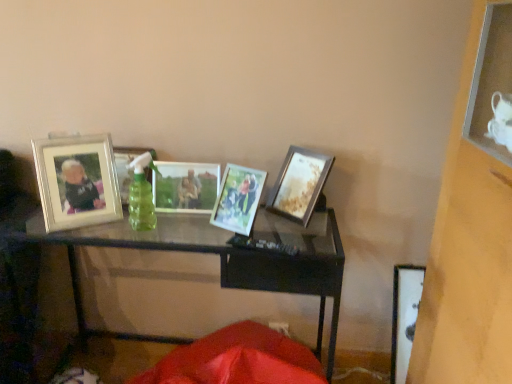
Question: From a real-world perspective, relative to silver metallic photo frame at left, arranged as the first picture frame when viewed from the left, is black glass table at center vertically above or below?

Choices:
 (A) below
 (B) above

Answer: (A)

Question: Based on their sizes in the image, would you say black glass table at center is bigger or smaller than silver metallic photo frame at left, arranged as the fifth picture frame when viewed from the right?

Choices:
 (A) small
 (B) big

Answer: (B)

Question: Based on their relative distances, which object is farther from the matte glass picture frame at left, the fourth picture frame from the right?

Choices:
 (A) silver metallic photo frame at left, arranged as the fifth picture frame when viewed from the right
 (B) metallic silver photo frame at center, the second picture frame positioned from the right
 (C) metallic silver photo frame at center, positioned as the 3th picture frame in right-to-left order
 (D) black glass table at center
 (E) wooden photo frame at center, the 1th picture frame when ordered from right to left

Answer: (E)

Question: Which of these objects is positioned farthest from the metallic silver photo frame at center, positioned as the 3th picture frame in right-to-left order?

Choices:
 (A) matte glass picture frame at left, placed as the 2th picture frame when sorted from left to right
 (B) silver metallic photo frame at left, arranged as the first picture frame when viewed from the left
 (C) metallic silver photo frame at center, the second picture frame positioned from the right
 (D) black glass table at center
 (E) wooden photo frame at center, the 1th picture frame when ordered from right to left

Answer: (E)